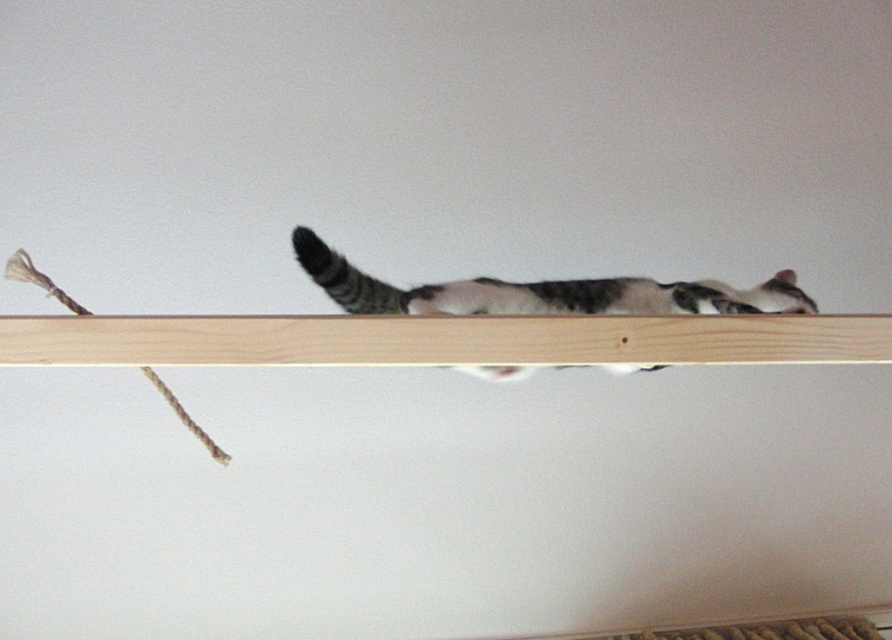
You are a cat owner who wants to place a new toy on the shelf where the gray tabby cat at center is lying. Based on the scene, can you determine if the light wood shelf at center has enough space for the toy?

The light wood shelf at center is below the gray tabby cat at center, so there might be space available on the shelf. However, since the cat is lying on it, the owner should check if there is enough space around the cat to place the toy without disturbing it.

You are an interior designer planning to place a small plant pot on the light wood shelf at center where the gray tabby cat at center is currently lying. Based on the space available, will the cat and the plant pot fit comfortably on the shelf together?

The light wood shelf at center occupies less space than gray tabby cat at center, so there might not be enough room for both the cat and the plant pot to fit comfortably together on the shelf.

Please provide the 2D coordinates of the light wood shelf at center in the image. The coordinates should be in the format of a tuple with two decimal numbers separated by a comma, like this example format. Please do not add any extra text or explanation, just the coordinates in the requested format.

Result: The coordinates are exactly at point (x=443, y=340) as stated in the Objects Description.